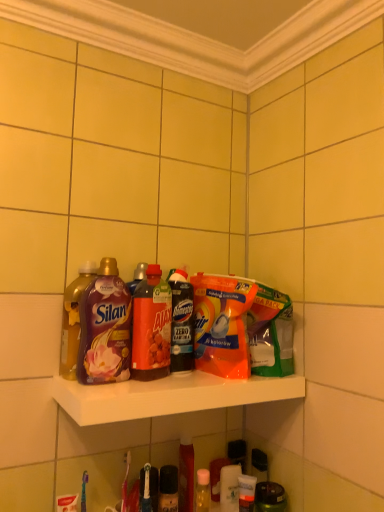
This screenshot has height=512, width=384. Find the location of `empty space that is ontop of white glossy shelf at center (from a real-world perspective)`. empty space that is ontop of white glossy shelf at center (from a real-world perspective) is located at coordinates (167, 380).